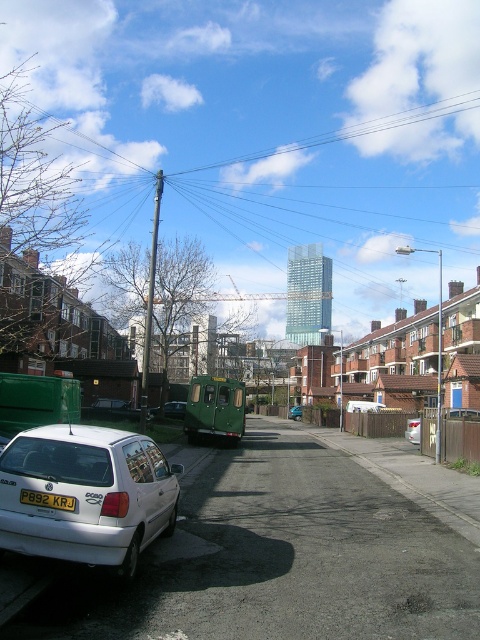
You are standing on the street and want to walk from point (167, 416) to point (290, 417). Which direction should you face to move towards the point that is farther away?

You should face away from the viewer because point (290, 417) is farther away from you than point (167, 416).

You are standing at the center of the street and want to locate the white matte hatchback at lower left. According to the coordinates provided, in which direction should you look relative to your position?

The white matte hatchback at lower left is located at coordinates point (86, 493), so you should look to the lower left direction relative to your position.